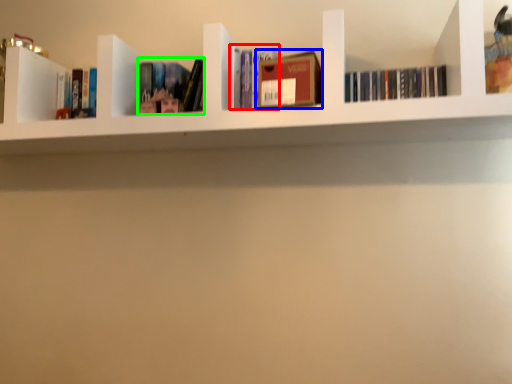
Question: Considering the real-world distances, which object is farthest from book (highlighted by a red box)? book (highlighted by a blue box) or book (highlighted by a green box)?

Choices:
 (A) book
 (B) book

Answer: (B)